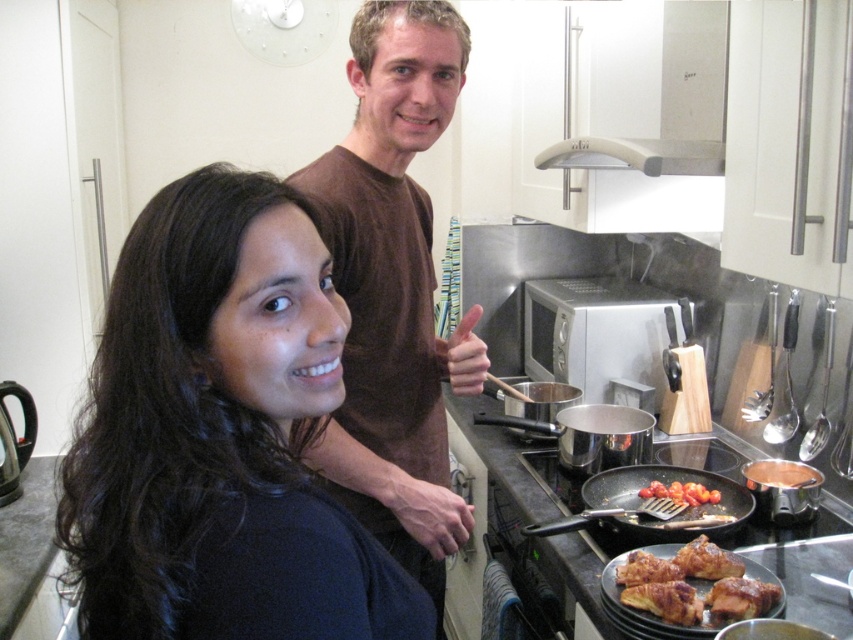
Question: Which point appears closest to the camera in this image?

Choices:
 (A) (756, 582)
 (B) (602, 164)
 (C) (624, 474)

Answer: (A)

Question: Can you confirm if brown cotton shirt at upper center is positioned to the left of shiny red tomatoes at center?

Choices:
 (A) yes
 (B) no

Answer: (A)

Question: Is black matte hair at upper left smaller than white glossy exhaust hood at upper center?

Choices:
 (A) yes
 (B) no

Answer: (A)

Question: From the image, what is the correct spatial relationship of white glossy exhaust hood at upper center in relation to shiny red tomatoes at center?

Choices:
 (A) right
 (B) left

Answer: (B)

Question: Which object is farther from the camera taking this photo?

Choices:
 (A) black matte hair at upper left
 (B) brown cotton shirt at upper center
 (C) golden crispy pastry at lower right
 (D) black non-stick frying pan at lower right

Answer: (D)

Question: Among these points, which one is farthest from the camera?

Choices:
 (A) (210, 186)
 (B) (402, 486)

Answer: (B)